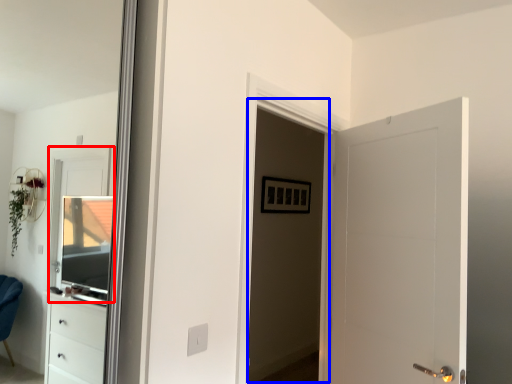
Question: Which object is closer to the camera taking this photo, window (highlighted by a red box) or screen door (highlighted by a blue box)?

Choices:
 (A) window
 (B) screen door

Answer: (B)